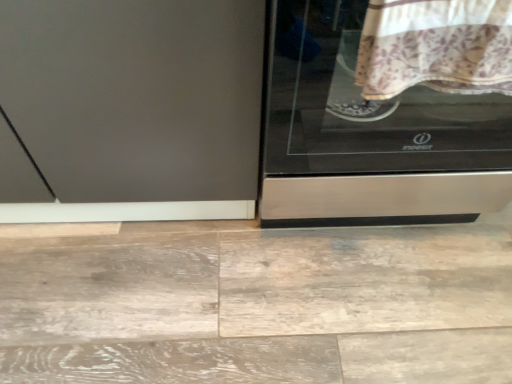
Question: From the image's perspective, would you say stainless steel cooktop at right is positioned over matte gray screen door at left?

Choices:
 (A) no
 (B) yes

Answer: (A)

Question: From a real-world perspective, is stainless steel cooktop at right physically above matte gray screen door at left?

Choices:
 (A) yes
 (B) no

Answer: (A)

Question: Is stainless steel cooktop at right looking in the opposite direction of matte gray screen door at left?

Choices:
 (A) no
 (B) yes

Answer: (A)

Question: Is stainless steel cooktop at right taller than matte gray screen door at left?

Choices:
 (A) yes
 (B) no

Answer: (A)

Question: Is the surface of stainless steel cooktop at right in direct contact with matte gray screen door at left?

Choices:
 (A) yes
 (B) no

Answer: (B)

Question: Based on their positions, is matte gray screen door at left located to the left or right of stainless steel cooktop at right?

Choices:
 (A) left
 (B) right

Answer: (A)

Question: Considering the positions of matte gray screen door at left and stainless steel cooktop at right in the image, is matte gray screen door at left taller or shorter than stainless steel cooktop at right?

Choices:
 (A) short
 (B) tall

Answer: (A)

Question: Considering the positions of matte gray screen door at left and stainless steel cooktop at right in the image, is matte gray screen door at left wider or thinner than stainless steel cooktop at right?

Choices:
 (A) thin
 (B) wide

Answer: (A)

Question: Does point (80, 155) appear closer or farther from the camera than point (399, 201)?

Choices:
 (A) farther
 (B) closer

Answer: (B)

Question: Is floral cotton blanket at upper right wider or thinner than matte gray screen door at left?

Choices:
 (A) thin
 (B) wide

Answer: (A)

Question: From the image's perspective, is floral cotton blanket at upper right located above or below matte gray screen door at left?

Choices:
 (A) below
 (B) above

Answer: (A)

Question: In terms of height, does floral cotton blanket at upper right look taller or shorter compared to matte gray screen door at left?

Choices:
 (A) tall
 (B) short

Answer: (B)

Question: From a real-world perspective, relative to matte gray screen door at left, is floral cotton blanket at upper right vertically above or below?

Choices:
 (A) below
 (B) above

Answer: (B)

Question: Based on their positions, is floral cotton blanket at upper right located to the left or right of stainless steel cooktop at right?

Choices:
 (A) right
 (B) left

Answer: (A)

Question: Is point (506, 56) closer or farther from the camera than point (301, 54)?

Choices:
 (A) closer
 (B) farther

Answer: (A)